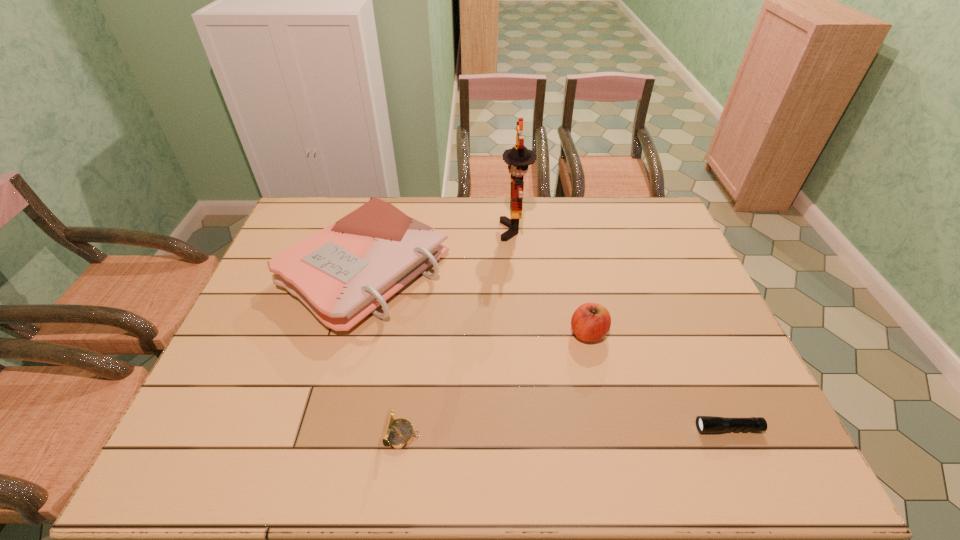
This screenshot has width=960, height=540. What are the coordinates of `object that is positioned at the right edge` in the screenshot? It's located at (705, 424).

Where is `object at the far left corner`? object at the far left corner is located at coordinates (342, 273).

Locate an element on the screen. This screenshot has height=540, width=960. vacant position at the far edge of the desktop is located at coordinates (583, 211).

In the image, there is a desktop. Where is `vacant space at the near edge`? This screenshot has width=960, height=540. vacant space at the near edge is located at coordinates (499, 475).

You are a GUI agent. You are given a task and a screenshot of the screen. Output one action in this format:
    pyautogui.click(x=<x>, y=<y>)
    Task: Click on the vacant space at the left edge of the desktop
    
    Given the screenshot: What is the action you would take?
    pyautogui.click(x=237, y=406)

Where is `vacant space at the right edge of the desktop`? The width and height of the screenshot is (960, 540). vacant space at the right edge of the desktop is located at coordinates (668, 336).

This screenshot has height=540, width=960. In order to click on vacant space at the far left corner in this screenshot , I will do `click(331, 200)`.

In the image, there is a desktop. Where is `free space at the far right corner`? The height and width of the screenshot is (540, 960). free space at the far right corner is located at coordinates (651, 225).

Identify the location of vacant area between the flashlight and the nutcracker. tap(621, 329).

Find the location of a particular element. Image resolution: width=960 pixels, height=540 pixels. vacant space in between the shortest object and the third object from left to right is located at coordinates (621, 329).